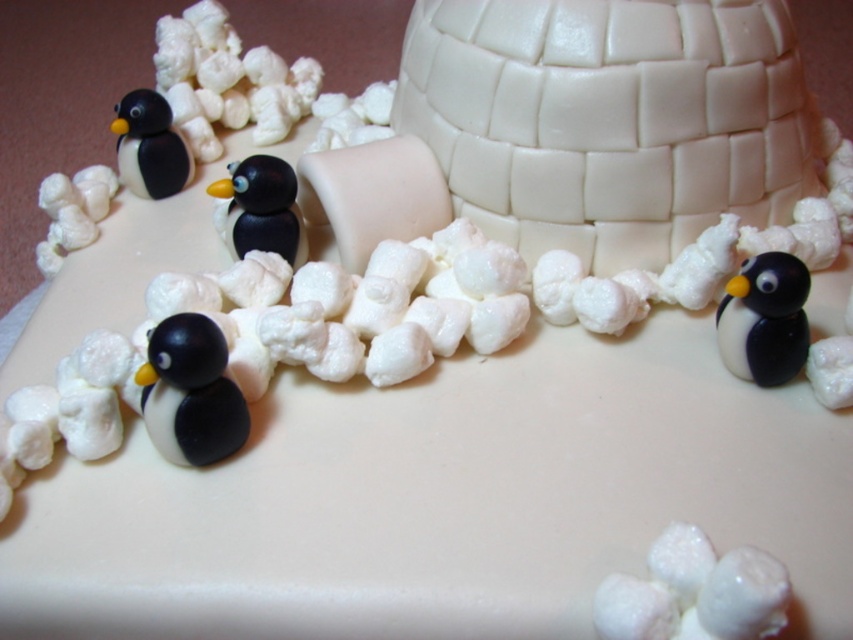
Does matte black penguin at center appear under black matte penguin at upper left?

Yes.

Which is above, matte black penguin at center or black matte penguin at upper left?

Positioned higher is black matte penguin at upper left.

Is point (276, 216) positioned before point (136, 180)?

Yes.

This screenshot has width=853, height=640. Identify the location of matte black penguin at center. [260, 209].

Is point (224, 348) positioned in front of point (247, 250)?

Yes, point (224, 348) is in front of point (247, 250).

Which of these two, matte black penguin at lower left or matte black penguin at center, stands taller?

matte black penguin at lower left is taller.

Between point (227, 419) and point (230, 241), which one is positioned behind?

The point (230, 241) is more distant.

This screenshot has width=853, height=640. Identify the location of matte black penguin at lower left. (190, 392).

Does matte black penguin at lower left have a lesser height compared to black glossy penguin at lower right?

Incorrect, matte black penguin at lower left's height does not fall short of black glossy penguin at lower right's.

Does point (213, 429) lie behind point (804, 310)?

No, (213, 429) is closer to viewer.

Locate an element on the screen. Image resolution: width=853 pixels, height=640 pixels. matte black penguin at lower left is located at coordinates (190, 392).